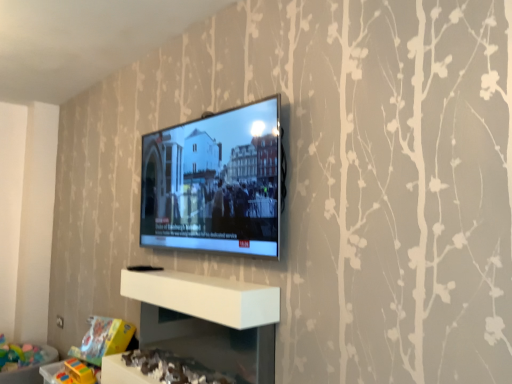
The image size is (512, 384). What do you see at coordinates (205, 297) in the screenshot?
I see `white matte shelf at center, the 1th shelf from the top` at bounding box center [205, 297].

What do you see at coordinates (211, 343) in the screenshot? I see `white glossy shelf at lower center, placed as the 1th shelf when sorted from bottom to top` at bounding box center [211, 343].

Identify the location of white matte shelf at center, which is the second shelf from bottom to top. (205, 297).

From the image's perspective, between white matte shelf at center, the 1th shelf from the top, and matte black tv at center, who is located below?

From the image's view, white matte shelf at center, the 1th shelf from the top, is below.

Could you tell me if white matte shelf at center, which is the second shelf from bottom to top, is facing matte black tv at center?

No, white matte shelf at center, which is the second shelf from bottom to top, is not facing towards matte black tv at center.

Which object is more forward, white matte shelf at center, which is the second shelf from bottom to top, or matte black tv at center?

white matte shelf at center, which is the second shelf from bottom to top, is more forward.

In the scene shown: Which is more to the right, white matte shelf at center, which is the second shelf from bottom to top, or matte black tv at center?

matte black tv at center is more to the right.

Is matte black tv at center further to the viewer compared to white glossy shelf at lower center, the second shelf positioned from the top?

Yes, the depth of matte black tv at center is greater than that of white glossy shelf at lower center, the second shelf positioned from the top.

From a real-world perspective, which object stands above the other?

matte black tv at center, from a real-world perspective.

Considering the relative sizes of matte black tv at center and white glossy shelf at lower center, placed as the 1th shelf when sorted from bottom to top, in the image provided, is matte black tv at center wider than white glossy shelf at lower center, placed as the 1th shelf when sorted from bottom to top,?

No, matte black tv at center is not wider than white glossy shelf at lower center, placed as the 1th shelf when sorted from bottom to top.

Is white glossy shelf at lower center, placed as the 1th shelf when sorted from bottom to top, taller than matte black tv at center?

Incorrect, the height of white glossy shelf at lower center, placed as the 1th shelf when sorted from bottom to top, is not larger of that of matte black tv at center.

Are white glossy shelf at lower center, the second shelf positioned from the top, and matte black tv at center located far from each other?

No, white glossy shelf at lower center, the second shelf positioned from the top, is in close proximity to matte black tv at center.

This screenshot has height=384, width=512. What are the coordinates of `television above the white glossy shelf at lower center, placed as the 1th shelf when sorted from bottom to top (from the image's perspective)` in the screenshot? It's located at (215, 182).

From a real-world perspective, is white glossy shelf at lower center, placed as the 1th shelf when sorted from bottom to top, on matte black tv at center?

Incorrect, from a real-world perspective, white glossy shelf at lower center, placed as the 1th shelf when sorted from bottom to top, is lower than matte black tv at center.

Who is shorter, white glossy shelf at lower center, the second shelf positioned from the top, or white matte shelf at center, the 1th shelf from the top?

Answer: white matte shelf at center, the 1th shelf from the top, is shorter.

From the image's perspective, which is below, white glossy shelf at lower center, the second shelf positioned from the top, or white matte shelf at center, the 1th shelf from the top?

white glossy shelf at lower center, the second shelf positioned from the top, from the image's perspective.

Does white glossy shelf at lower center, the second shelf positioned from the top, lie in front of white matte shelf at center, the 1th shelf from the top?

Yes, it is.

Which point is more distant from viewer, (173, 322) or (226, 282)?

The point (173, 322) is farther.

Consider the image. Does matte black tv at center come in front of white matte shelf at center, the 1th shelf from the top?

No, matte black tv at center is behind white matte shelf at center, the 1th shelf from the top.

Which of these two, matte black tv at center or white matte shelf at center, which is the second shelf from bottom to top, is bigger?

Bigger between the two is matte black tv at center.

Does matte black tv at center contain white matte shelf at center, the 1th shelf from the top?

That's incorrect, white matte shelf at center, the 1th shelf from the top, is not inside matte black tv at center.

From the image's perspective, which one is positioned lower, white matte shelf at center, the 1th shelf from the top, or white glossy shelf at lower center, the second shelf positioned from the top?

white glossy shelf at lower center, the second shelf positioned from the top.

Is white matte shelf at center, which is the second shelf from bottom to top, wider or thinner than white glossy shelf at lower center, the second shelf positioned from the top?

white matte shelf at center, which is the second shelf from bottom to top, is thinner than white glossy shelf at lower center, the second shelf positioned from the top.

Is white matte shelf at center, which is the second shelf from bottom to top, shorter than white glossy shelf at lower center, the second shelf positioned from the top?

Correct, white matte shelf at center, which is the second shelf from bottom to top, is not as tall as white glossy shelf at lower center, the second shelf positioned from the top.

The image size is (512, 384). I want to click on shelf above the white glossy shelf at lower center, the second shelf positioned from the top (from a real-world perspective), so click(x=205, y=297).

Locate an element on the screen. shelf that is the 1st object located in front of the matte black tv at center is located at coordinates pos(205,297).

Identify the location of television lying on the right of white glossy shelf at lower center, placed as the 1th shelf when sorted from bottom to top. This screenshot has height=384, width=512. (215, 182).

When comparing their distances from white matte shelf at center, which is the second shelf from bottom to top, does matte black tv at center or white glossy shelf at lower center, the second shelf positioned from the top, seem closer?

The object closer to white matte shelf at center, which is the second shelf from bottom to top, is white glossy shelf at lower center, the second shelf positioned from the top.

From the image, which object appears to be nearer to white matte shelf at center, which is the second shelf from bottom to top, white glossy shelf at lower center, placed as the 1th shelf when sorted from bottom to top, or matte black tv at center?

white glossy shelf at lower center, placed as the 1th shelf when sorted from bottom to top, lies closer to white matte shelf at center, which is the second shelf from bottom to top, than the other object.

Which object lies further to the anchor point matte black tv at center, white glossy shelf at lower center, the second shelf positioned from the top, or white matte shelf at center, which is the second shelf from bottom to top?

white glossy shelf at lower center, the second shelf positioned from the top, is positioned further to the anchor matte black tv at center.

Which object lies further to the anchor point white glossy shelf at lower center, the second shelf positioned from the top, matte black tv at center or white matte shelf at center, the 1th shelf from the top?

Among the two, matte black tv at center is located further to white glossy shelf at lower center, the second shelf positioned from the top.

When comparing their distances from white glossy shelf at lower center, the second shelf positioned from the top, does white matte shelf at center, the 1th shelf from the top, or matte black tv at center seem closer?

The object closer to white glossy shelf at lower center, the second shelf positioned from the top, is white matte shelf at center, the 1th shelf from the top.

Estimate the real-world distances between objects in this image. Which object is further from matte black tv at center, white matte shelf at center, the 1th shelf from the top, or white glossy shelf at lower center, placed as the 1th shelf when sorted from bottom to top?

The object further to matte black tv at center is white glossy shelf at lower center, placed as the 1th shelf when sorted from bottom to top.

Identify the location of shelf between matte black tv at center and white glossy shelf at lower center, placed as the 1th shelf when sorted from bottom to top, from top to bottom. (205, 297).